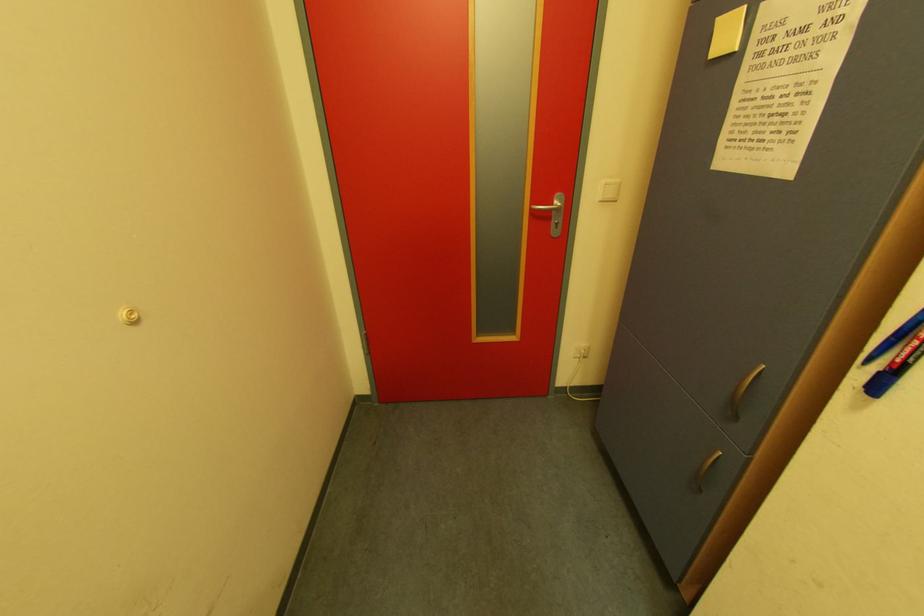
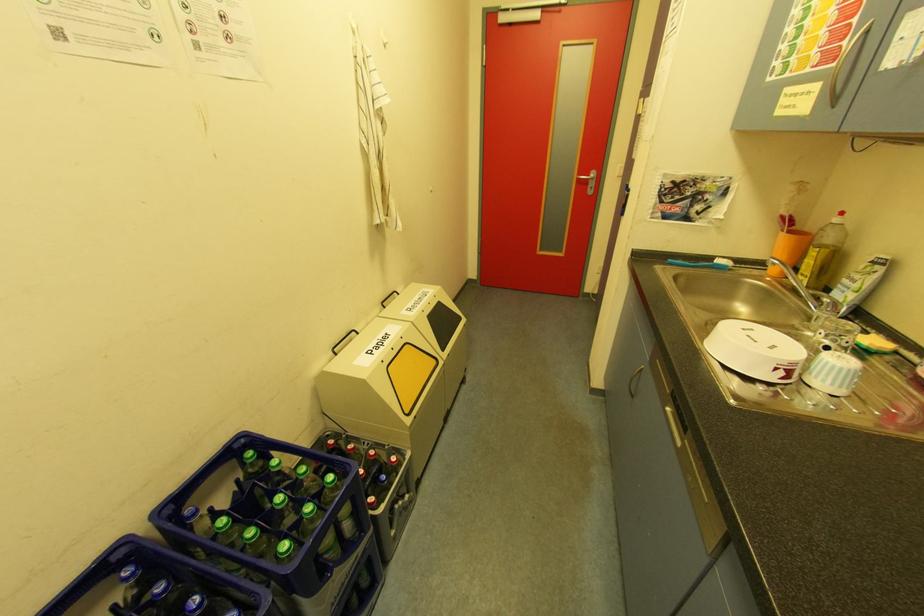
Question: Which direction would the cameraman need to move to produce the second image? Reply with the corresponding letter.

Choices:
 (A) Left
 (B) Right
 (C) Forward
 (D) Backward

Answer: (D)